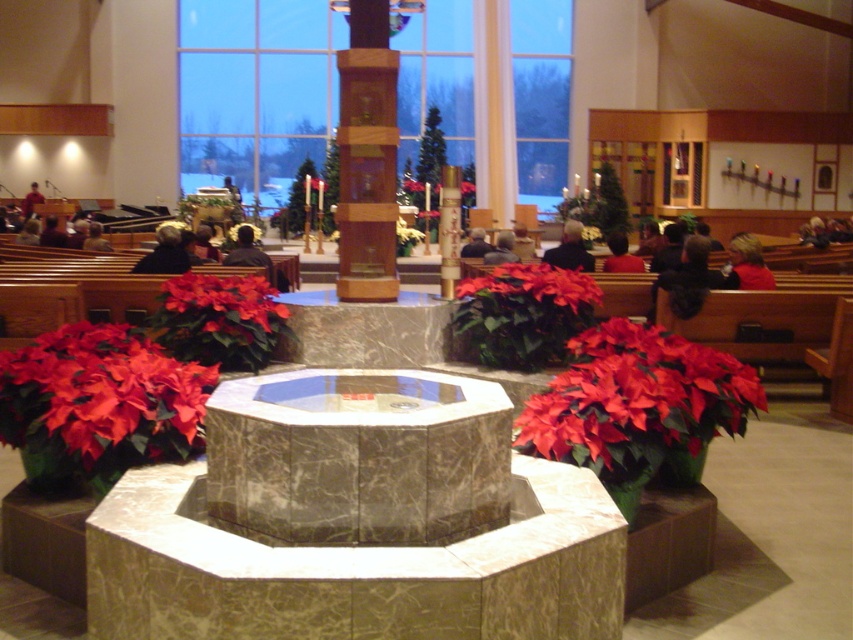
You are standing at the entrance of the church and want to place a new flower pot between the matte red poinsettia at lower right and the wooden pillar at center. Can you place it directly in the middle between them?

The matte red poinsettia at lower right is positioned on the right side of wooden pillar at center, so placing a flower pot directly in the middle between them would be possible as there is space between the two objects.

You are an event planner setting up decorations in the church. You need to place a large banner that requires hanging it on an object that can support its weight. Based on the scene, which object between the wooden pillar at center and the red matte poinsettia at center would be more suitable for hanging the banner?

The wooden pillar at center is bigger than the red matte poinsettia at center, so the wooden pillar at center would be more suitable for hanging the banner as it can support the weight better.

You are standing in the church and want to place a small gift on the nearest object. Which object should you choose between the matte red poinsettia at lower right and the dark marble baptismal font centrally in the foreground?

The dark marble baptismal font centrally in the foreground is closer to you than the matte red poinsettia at lower right, so you should place the gift on the dark marble baptismal font centrally in the foreground.